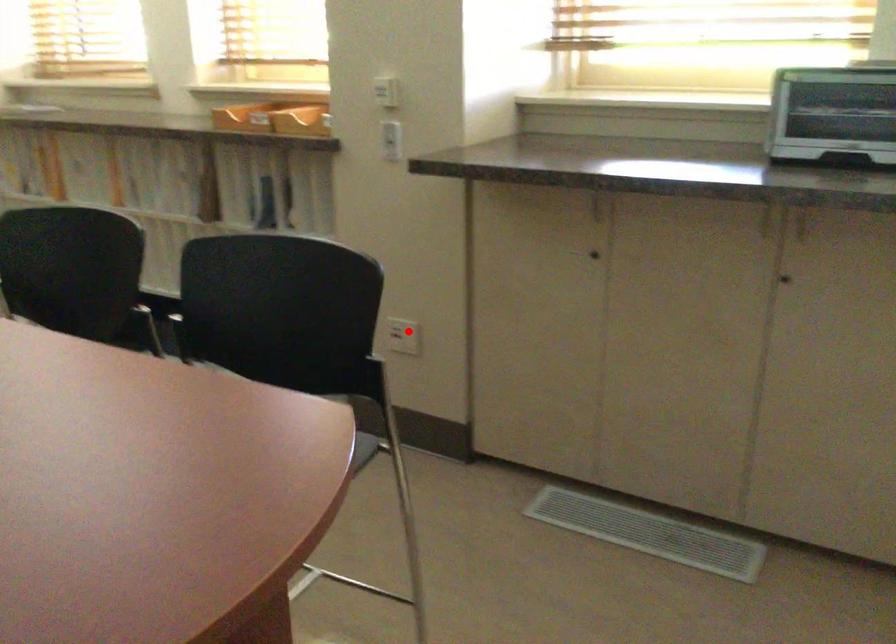
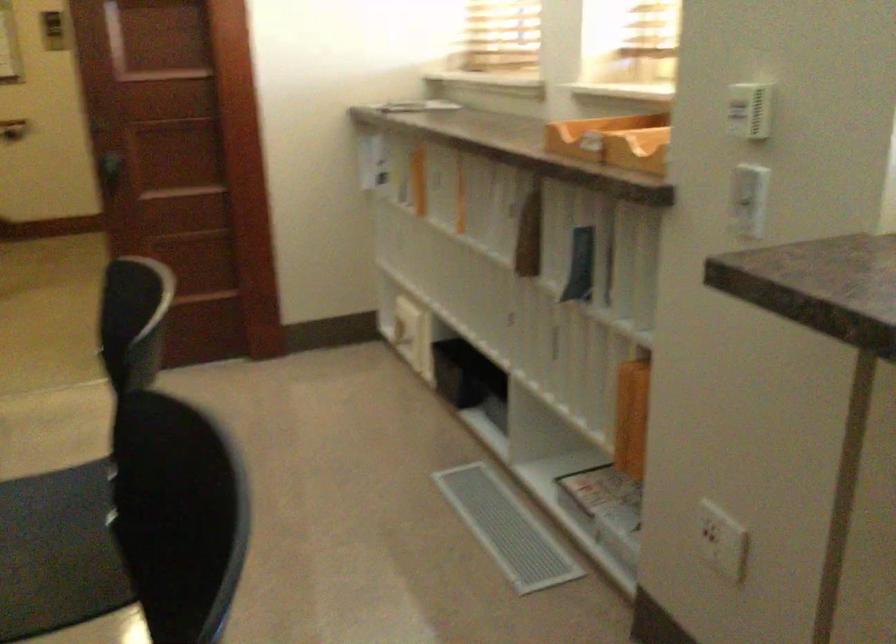
Question: I am providing you with two images of the same scene from different viewpoints. Given a red point in image1, look at the same physical point in image2. Is it:

Choices:
 (A) Closer to the viewpoint
 (B) Farther from the viewpoint

Answer: (A)